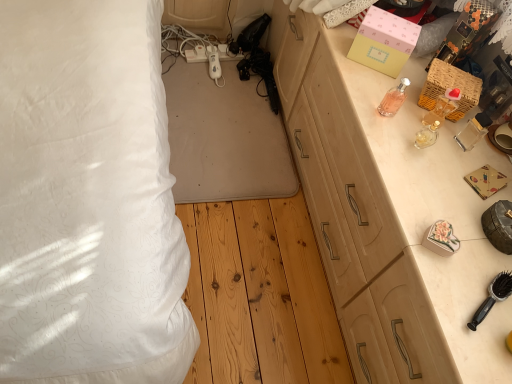
Locate an element on the screen. This screenshot has height=384, width=512. free space between black plastic brush at lower right and woven wicker basket at upper right, which is the second box from left to right is located at coordinates (449, 187).